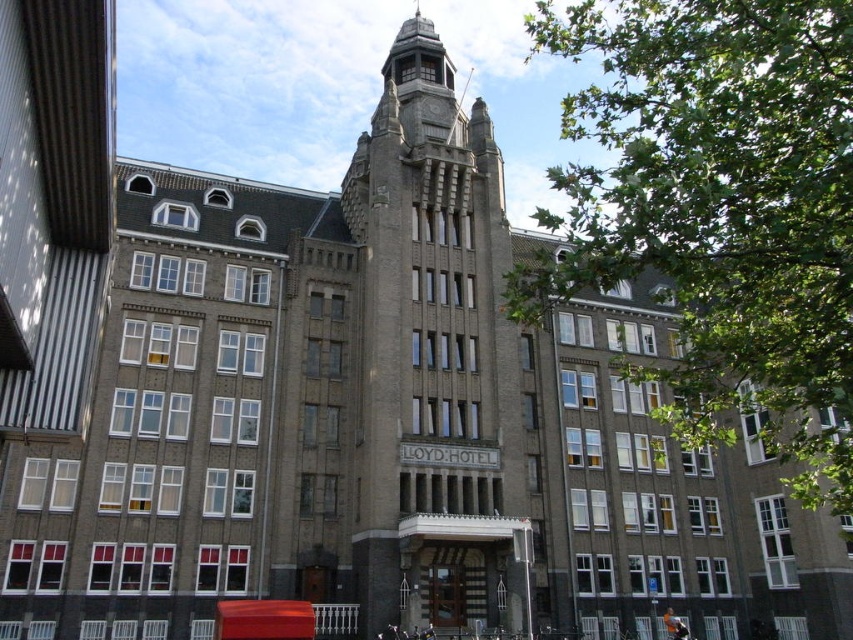
Based on the scene description, where is the green leafy tree at upper right located in terms of its 2D coordinates?

The green leafy tree at upper right is located at coordinates (718, 209).

You are standing in front of the building and want to know if the green leafy tree at upper right can block the view of the brown stone tower at center. Based on their sizes, can you determine if the tree might obscure the tower?

The green leafy tree at upper right is larger in size than the brown stone tower at center, so it might block the view of the tower depending on their positions.

What is the spatial relationship between the green leafy tree at upper right and the brown stone tower at center from the observer perspective?

The green leafy tree at upper right is closer to the viewer than the brown stone tower at center.